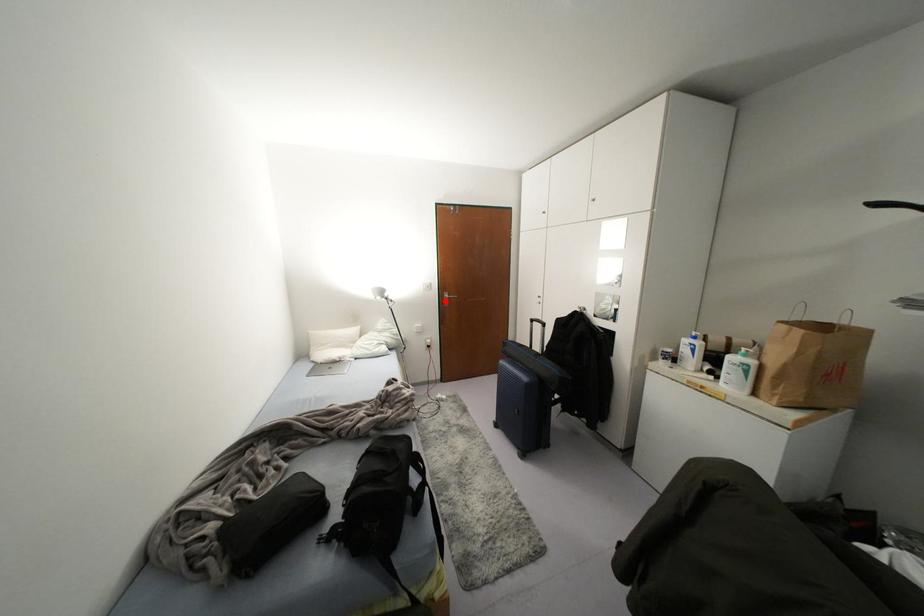
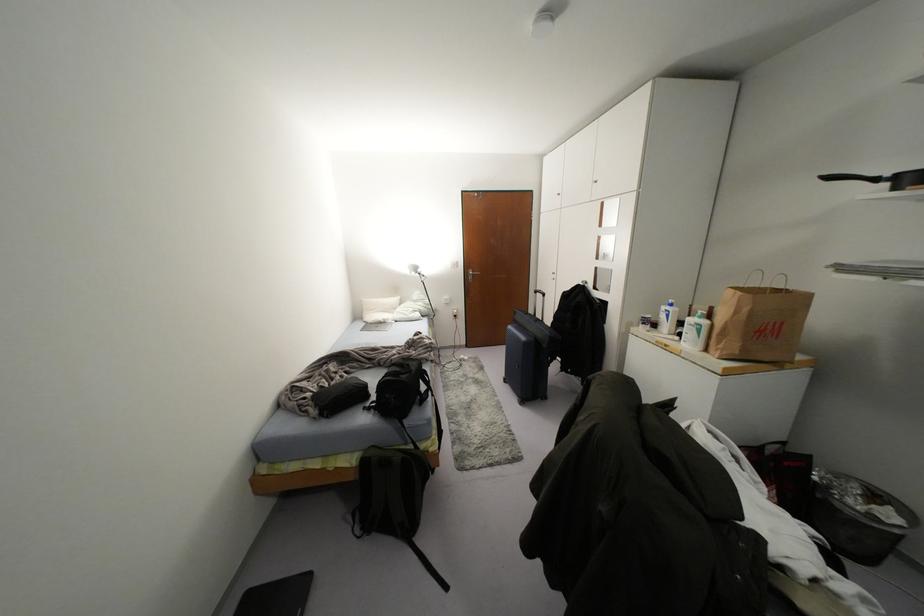
In the second image, find the point that corresponds to the highlighted location in the first image.

(469, 277)